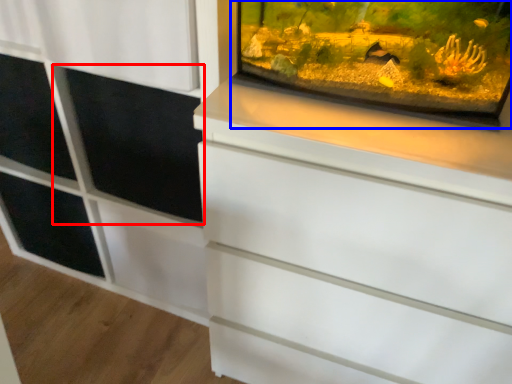
Question: Which object appears closest to the camera in this image, screen door (highlighted by a red box) or glass box (highlighted by a blue box)?

Choices:
 (A) screen door
 (B) glass box

Answer: (B)